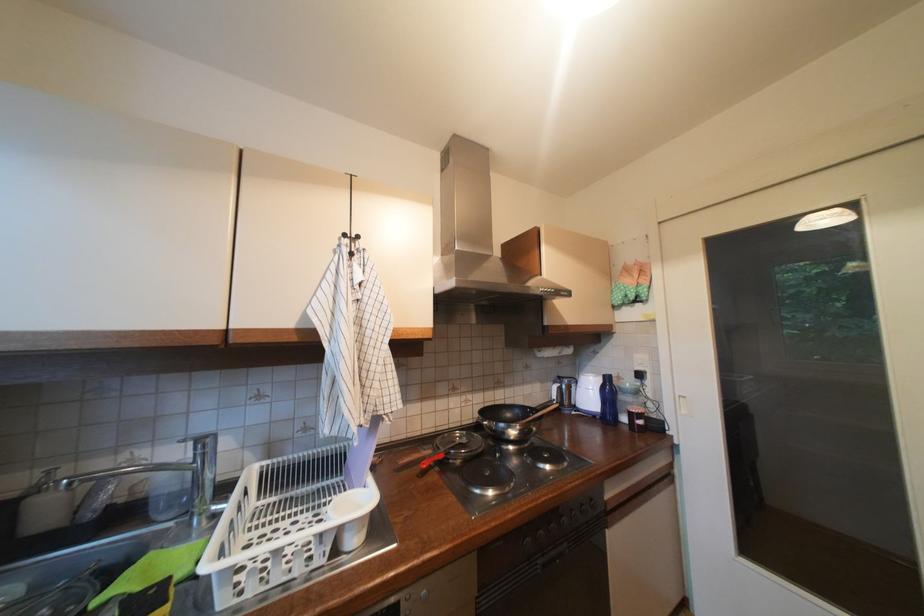
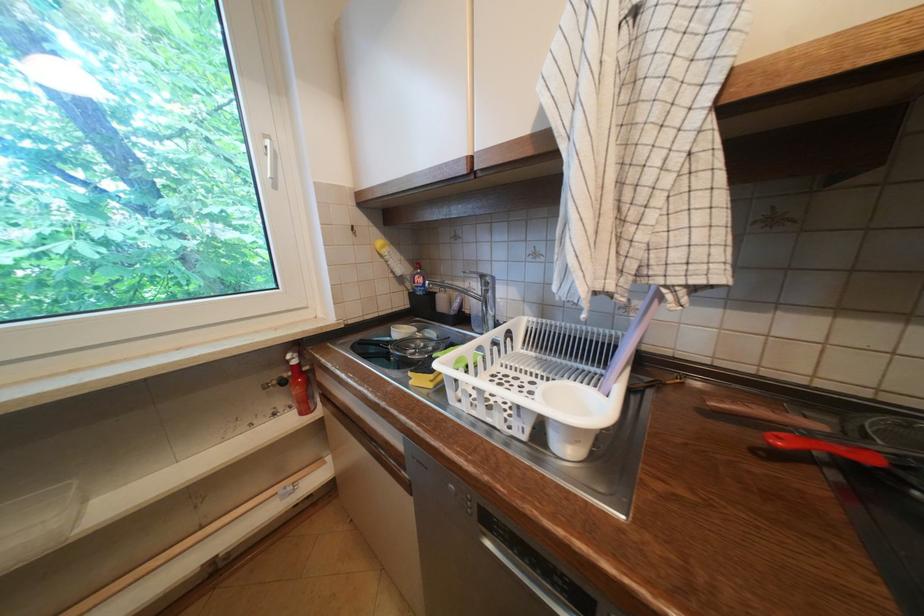
Where in the second image is the point corresponding to the point at 450,458 from the first image?

(881, 462)